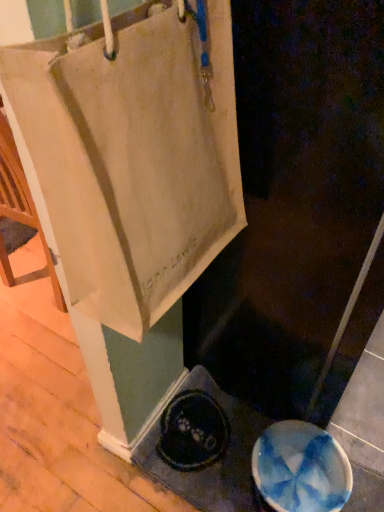
Question: Does white canvas bag at upper left have a smaller size compared to beige canvas tote at upper left?

Choices:
 (A) yes
 (B) no

Answer: (B)

Question: Is white canvas bag at upper left positioned with its back to beige canvas tote at upper left?

Choices:
 (A) no
 (B) yes

Answer: (A)

Question: From a real-world perspective, is white canvas bag at upper left positioned over beige canvas tote at upper left based on gravity?

Choices:
 (A) no
 (B) yes

Answer: (A)

Question: Would you say white canvas bag at upper left is outside beige canvas tote at upper left?

Choices:
 (A) yes
 (B) no

Answer: (A)

Question: Is white canvas bag at upper left positioned far away from beige canvas tote at upper left?

Choices:
 (A) no
 (B) yes

Answer: (A)

Question: Is white canvas bag at upper left aimed at beige canvas tote at upper left?

Choices:
 (A) yes
 (B) no

Answer: (B)

Question: Considering the relative sizes of beige canvas tote at upper left and blue glossy manhole cover at lower right in the image provided, is beige canvas tote at upper left shorter than blue glossy manhole cover at lower right?

Choices:
 (A) yes
 (B) no

Answer: (B)

Question: Can you confirm if beige canvas tote at upper left is wider than blue glossy manhole cover at lower right?

Choices:
 (A) yes
 (B) no

Answer: (B)

Question: Considering the relative sizes of beige canvas tote at upper left and blue glossy manhole cover at lower right in the image provided, is beige canvas tote at upper left taller than blue glossy manhole cover at lower right?

Choices:
 (A) yes
 (B) no

Answer: (A)

Question: Can you confirm if beige canvas tote at upper left is smaller than blue glossy manhole cover at lower right?

Choices:
 (A) no
 (B) yes

Answer: (A)

Question: Can you confirm if beige canvas tote at upper left is thinner than blue glossy manhole cover at lower right?

Choices:
 (A) no
 (B) yes

Answer: (B)

Question: From a real-world perspective, is beige canvas tote at upper left located higher than blue glossy manhole cover at lower right?

Choices:
 (A) no
 (B) yes

Answer: (B)

Question: Is blue glossy manhole cover at lower right positioned behind white canvas bag at upper left?

Choices:
 (A) no
 (B) yes

Answer: (B)